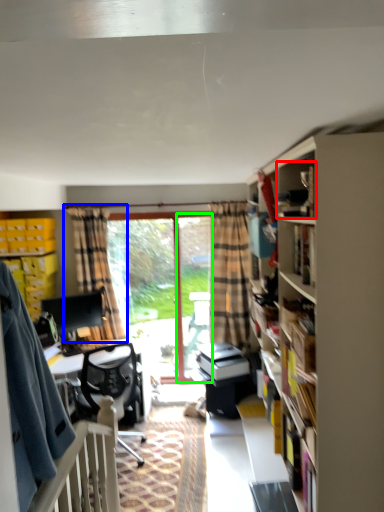
Question: Considering the real-world distances, which object is closest to book (highlighted by a red box)? curtain (highlighted by a blue box) or screen door (highlighted by a green box).

Choices:
 (A) curtain
 (B) screen door

Answer: (B)